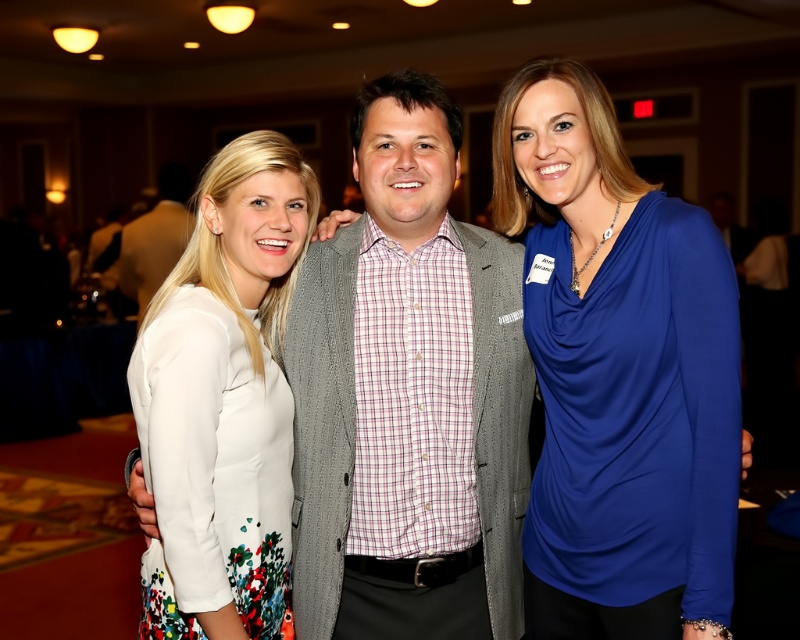
Is plaid fabric shirt at center below blue satin blouse at center?

Yes, plaid fabric shirt at center is below blue satin blouse at center.

Who is more distant from viewer, (509, 592) or (678, 260)?

Positioned behind is point (509, 592).

Identify the location of plaid fabric shirt at center. (408, 396).

Between blue satin blouse at center and white floral dress at center, which one is positioned lower?

white floral dress at center is below.

The width and height of the screenshot is (800, 640). Find the location of `blue satin blouse at center`. blue satin blouse at center is located at coordinates click(618, 374).

Is point (320, 584) positioned behind point (278, 611)?

Yes, point (320, 584) is farther from viewer.

Is point (377, 580) in front of point (222, 580)?

That is False.

What do you see at coordinates (408, 396) in the screenshot? The image size is (800, 640). I see `plaid fabric shirt at center` at bounding box center [408, 396].

The image size is (800, 640). In order to click on plaid fabric shirt at center in this screenshot , I will do `click(408, 396)`.